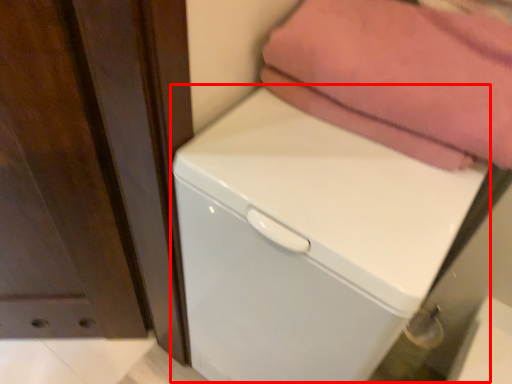
Question: From the image's perspective, where is dish washer (annotated by the red box) located in relation to towel in the image?

Choices:
 (A) below
 (B) above

Answer: (A)